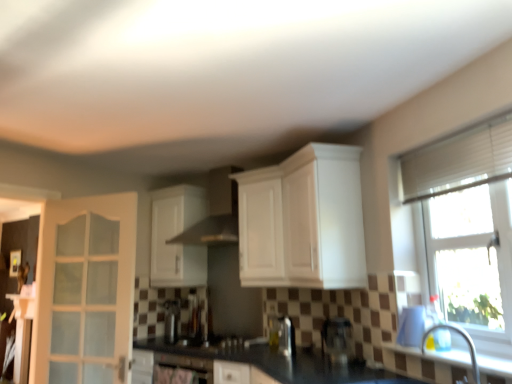
Question: Should I look upward or downward to see white glossy cabinet at upper center, positioned as the first cabinetry in left-to-right order?

Choices:
 (A) up
 (B) down

Answer: (B)

Question: Does satin black coffee machine at center, the 1th coffee machine in the right-to-left sequence, appear on the left side of white glossy window sill at lower right?

Choices:
 (A) yes
 (B) no

Answer: (A)

Question: Is satin black coffee machine at center, which appears as the first coffee machine when viewed from the front, oriented away from white glossy window sill at lower right?

Choices:
 (A) no
 (B) yes

Answer: (A)

Question: Is satin black coffee machine at center, which appears as the first coffee machine when viewed from the front, far from white glossy window sill at lower right?

Choices:
 (A) yes
 (B) no

Answer: (B)

Question: Does satin black coffee machine at center, which appears as the first coffee machine when viewed from the front, turn towards white glossy window sill at lower right?

Choices:
 (A) yes
 (B) no

Answer: (B)

Question: From the image's perspective, would you say satin black coffee machine at center, the second coffee machine from the back, is positioned over white glossy window sill at lower right?

Choices:
 (A) yes
 (B) no

Answer: (B)

Question: Is satin black coffee machine at center, which appears as the first coffee machine when viewed from the front, in contact with white glossy window sill at lower right?

Choices:
 (A) yes
 (B) no

Answer: (B)

Question: Can you confirm if black granite countertop at center is thinner than white plastic shutter at upper right?

Choices:
 (A) no
 (B) yes

Answer: (A)

Question: Is black granite countertop at center to the right of white plastic shutter at upper right from the viewer's perspective?

Choices:
 (A) no
 (B) yes

Answer: (A)

Question: From a real-world perspective, is black granite countertop at center over white plastic shutter at upper right?

Choices:
 (A) yes
 (B) no

Answer: (B)

Question: Is black granite countertop at center facing towards white plastic shutter at upper right?

Choices:
 (A) no
 (B) yes

Answer: (A)

Question: Considering the relative sizes of black granite countertop at center and white plastic shutter at upper right in the image provided, is black granite countertop at center wider than white plastic shutter at upper right?

Choices:
 (A) no
 (B) yes

Answer: (B)

Question: Is black granite countertop at center smaller than white plastic shutter at upper right?

Choices:
 (A) no
 (B) yes

Answer: (A)

Question: Is silver metallic faucet at lower right oriented towards black granite countertop at center?

Choices:
 (A) yes
 (B) no

Answer: (B)